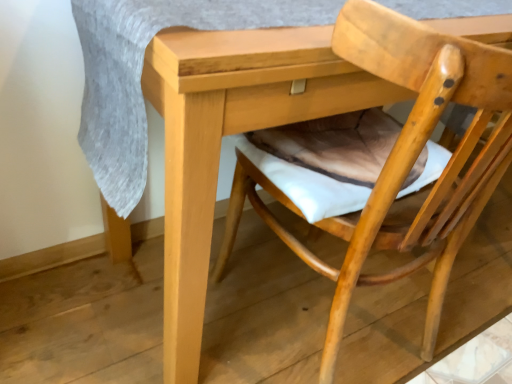
Describe the element at coordinates (403, 160) in the screenshot. I see `natural wood chair at center` at that location.

Where is `natural wood chair at center`? The image size is (512, 384). natural wood chair at center is located at coordinates (403, 160).

The width and height of the screenshot is (512, 384). I want to click on natural wood chair at center, so click(x=403, y=160).